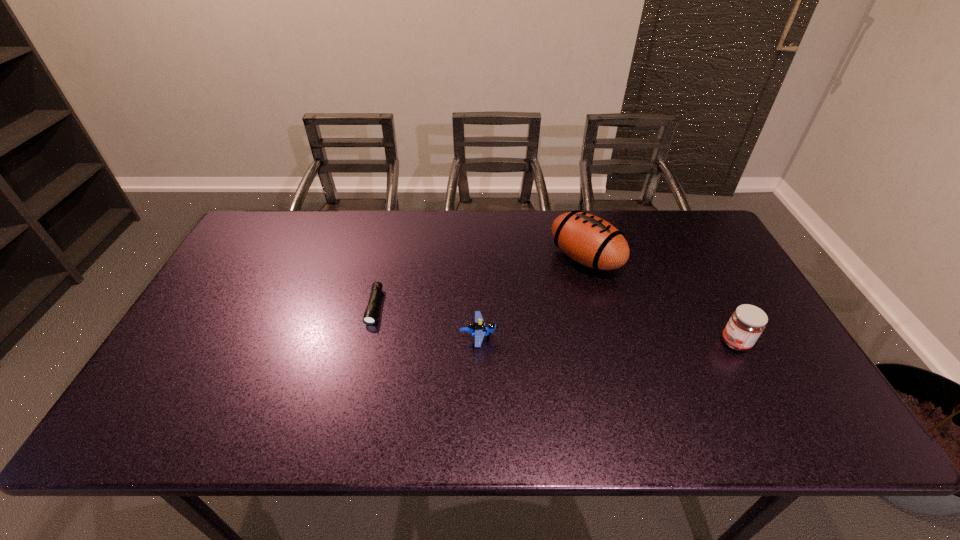
This screenshot has width=960, height=540. What are the coordinates of `vacant position located 0.060m on the front-facing side of the third tallest object` in the screenshot? It's located at (520, 337).

You are a GUI agent. You are given a task and a screenshot of the screen. Output one action in this format:
    pyautogui.click(x=<x>, y=<y>)
    Task: Click on the free space located 0.200m at the lens end of the flashlight
    Image resolution: width=960 pixels, height=540 pixels.
    Given the screenshot: What is the action you would take?
    pyautogui.click(x=354, y=390)

Locate an element on the screen. object that is positioned at the far edge is located at coordinates (589, 240).

What are the coordinates of `object located at the right edge` in the screenshot? It's located at (x=747, y=322).

I want to click on free space at the far edge of the desktop, so click(434, 240).

Where is `free space at the near edge`? The width and height of the screenshot is (960, 540). free space at the near edge is located at coordinates (582, 436).

Where is `free space at the left edge of the desktop`? The width and height of the screenshot is (960, 540). free space at the left edge of the desktop is located at coordinates (210, 299).

Locate an element on the screen. blank space at the right edge of the desktop is located at coordinates (715, 335).

The image size is (960, 540). What are the coordinates of `vacant position at the far left corner of the desktop` in the screenshot? It's located at (277, 210).

Where is `vacant space at the near left corner of the desktop`? The width and height of the screenshot is (960, 540). vacant space at the near left corner of the desktop is located at coordinates (204, 407).